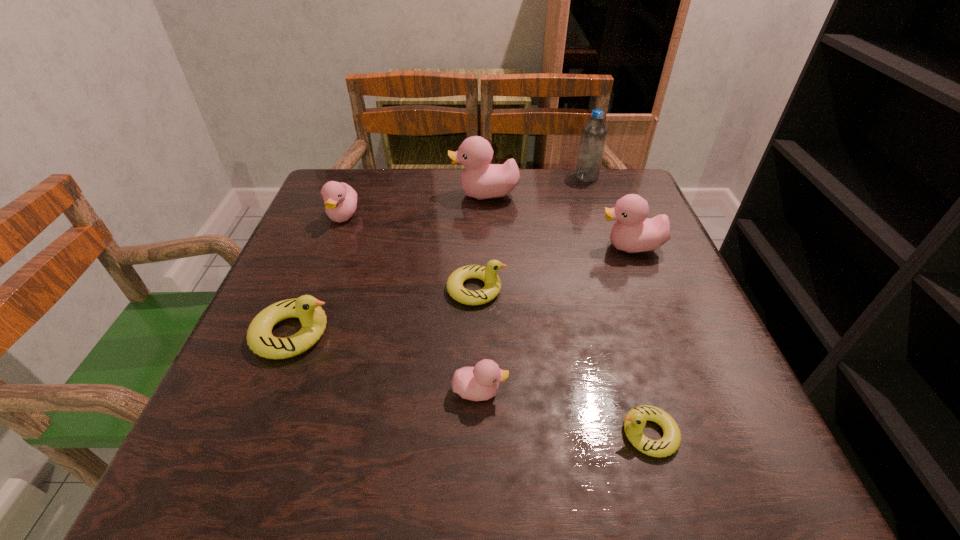
Identify which object is the second closest to the smallest pink duckling. Please provide its 2D coordinates. Your answer should be formatted as a tuple, i.e. [(x, y)], where the tuple contains the x and y coordinates of a point satisfying the conditions above.

[(635, 420)]

Locate which object is the second closest to the leftmost pink duckling. Please provide its 2D coordinates. Your answer should be formatted as a tuple, i.e. [(x, y)], where the tuple contains the x and y coordinates of a point satisfying the conditions above.

[(307, 308)]

Point out which duckling is positioned as the second nearest to the biggest pink duckling. Please provide its 2D coordinates. Your answer should be formatted as a tuple, i.e. [(x, y)], where the tuple contains the x and y coordinates of a point satisfying the conditions above.

[(340, 199)]

I want to click on the fourth closest duckling relative to the second tallest object, so click(x=307, y=308).

Identify which pink duckling is located as the second nearest to the rightmost pink duckling. Please provide its 2D coordinates. Your answer should be formatted as a tuple, i.e. [(x, y)], where the tuple contains the x and y coordinates of a point satisfying the conditions above.

[(479, 383)]

Point out which pink duckling is positioned as the fourth nearest to the biggest yellow duckling. Please provide its 2D coordinates. Your answer should be formatted as a tuple, i.e. [(x, y)], where the tuple contains the x and y coordinates of a point satisfying the conditions above.

[(633, 232)]

Select which yellow duckling appears as the closest to the farthest object. Please provide its 2D coordinates. Your answer should be formatted as a tuple, i.e. [(x, y)], where the tuple contains the x and y coordinates of a point satisfying the conditions above.

[(488, 274)]

The image size is (960, 540). I want to click on yellow duckling that is the nearest to the biggest yellow duckling, so click(x=488, y=274).